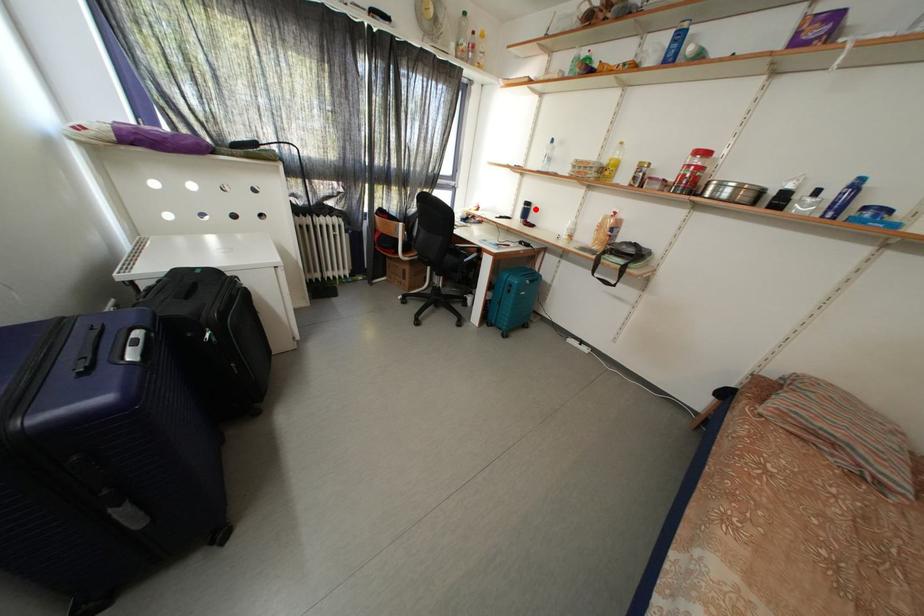
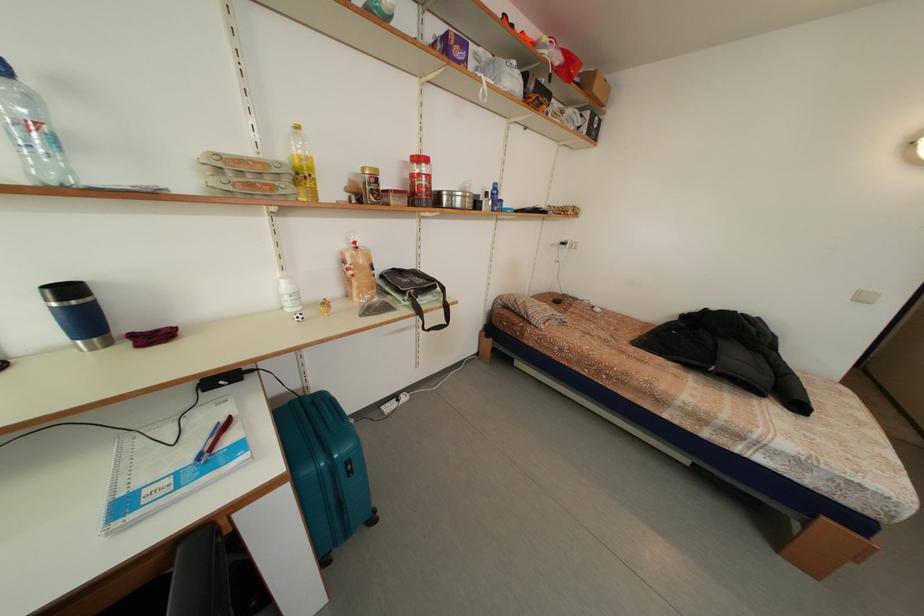
The point at the highlighted location is marked in the first image. Where is the corresponding point in the second image?

(78, 296)